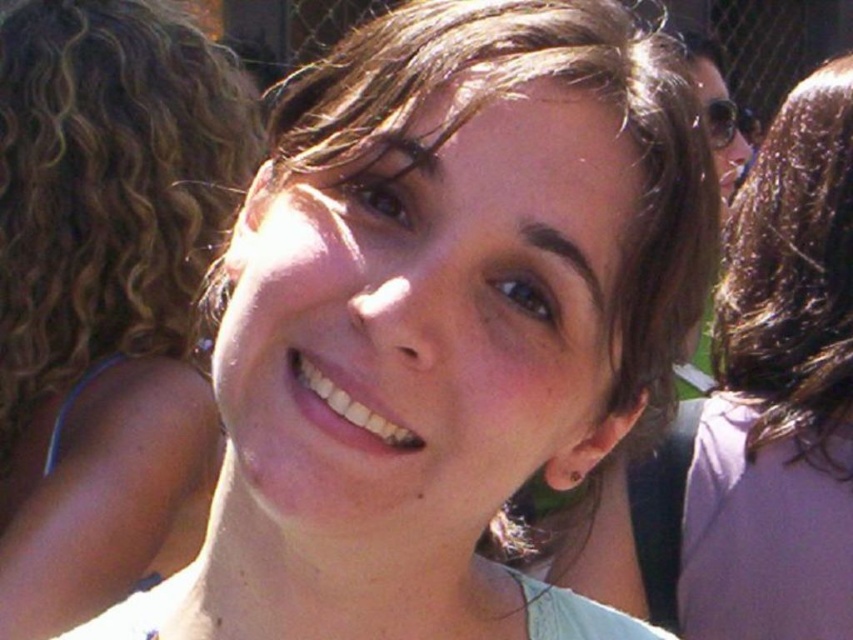
Between matte skin at center and smooth brown hair at center, which one is positioned lower?

Positioned lower is smooth brown hair at center.

Who is positioned more to the right, matte skin at center or smooth brown hair at center?

smooth brown hair at center

Which is behind, point (158, 387) or point (770, 360)?

The point (770, 360) is behind.

Locate an element on the screen. This screenshot has width=853, height=640. matte skin at center is located at coordinates (106, 296).

Locate an element on the screen. This screenshot has width=853, height=640. matte skin at center is located at coordinates (106, 296).

Can you confirm if matte skin at center is smaller than brown shiny hair at center?

No, matte skin at center is not smaller than brown shiny hair at center.

Which is in front, point (108, 380) or point (544, 496)?

Point (544, 496)

This screenshot has width=853, height=640. I want to click on matte skin at center, so click(106, 296).

Is brown shiny hair at center thinner than smooth brown hair at center?

In fact, brown shiny hair at center might be wider than smooth brown hair at center.

Who is more distant from viewer, (618, 403) or (746, 512)?

The point (746, 512) is more distant.

Describe the element at coordinates (531, 134) in the screenshot. The image size is (853, 640). I see `brown shiny hair at center` at that location.

The image size is (853, 640). In order to click on brown shiny hair at center in this screenshot , I will do `click(531, 134)`.